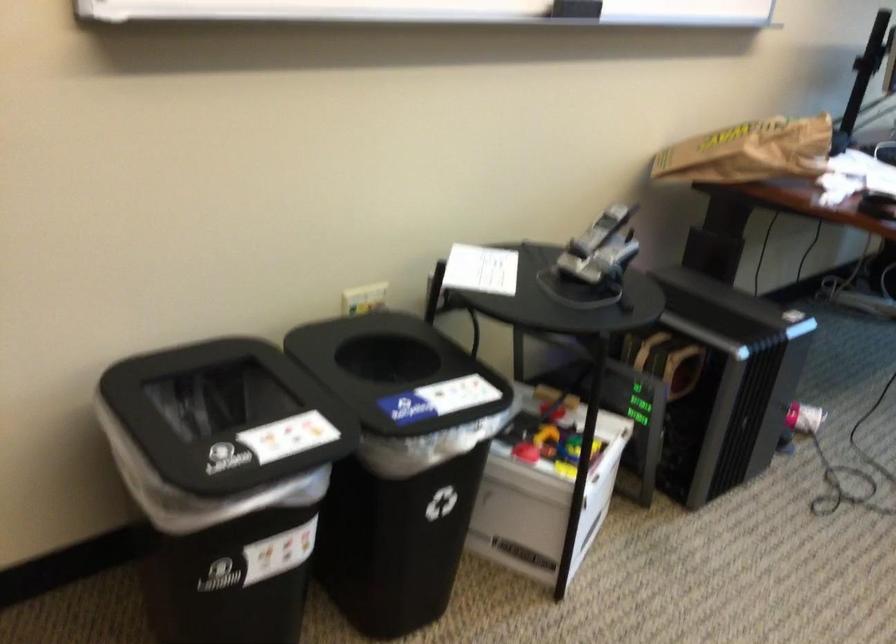
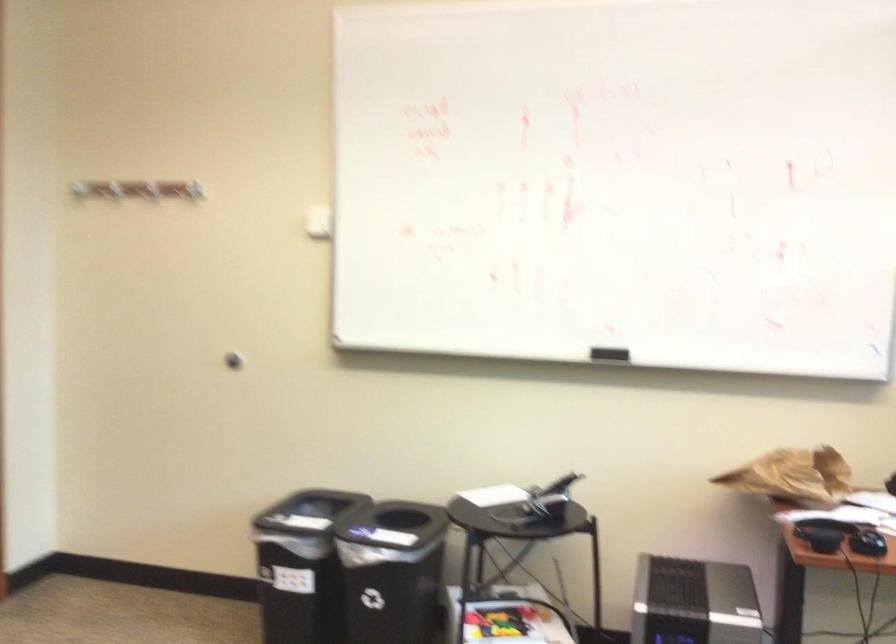
Where in the second image is the point corresponding to [599,260] from the first image?

(539, 503)